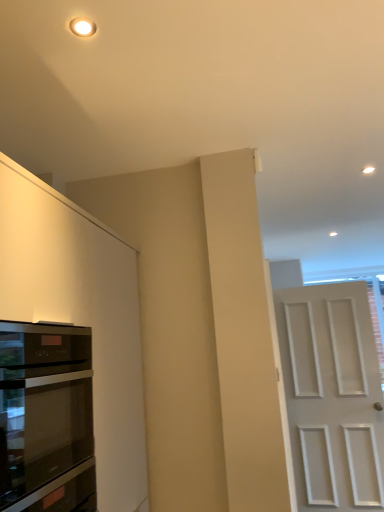
Question: Considering the relative sizes of matte white cabinet at left and black glass oven at left in the image provided, is matte white cabinet at left bigger than black glass oven at left?

Choices:
 (A) yes
 (B) no

Answer: (A)

Question: Is matte white cabinet at left thinner than black glass oven at left?

Choices:
 (A) no
 (B) yes

Answer: (A)

Question: From the image's perspective, is matte white cabinet at left below black glass oven at left?

Choices:
 (A) no
 (B) yes

Answer: (B)

Question: Would you say matte white cabinet at left is outside black glass oven at left?

Choices:
 (A) yes
 (B) no

Answer: (A)

Question: Does matte white cabinet at left have a greater width compared to black glass oven at left?

Choices:
 (A) no
 (B) yes

Answer: (B)

Question: In the image, is matte white cabinet at left positioned in front of or behind black glass oven at left?

Choices:
 (A) behind
 (B) front

Answer: (B)

Question: From a real-world perspective, is matte white cabinet at left physically located above or below black glass oven at left?

Choices:
 (A) above
 (B) below

Answer: (A)

Question: Looking at the image, does matte white cabinet at left seem bigger or smaller compared to black glass oven at left?

Choices:
 (A) big
 (B) small

Answer: (A)

Question: Looking at their shapes, would you say matte white cabinet at left is wider or thinner than black glass oven at left?

Choices:
 (A) thin
 (B) wide

Answer: (B)

Question: Is white matte door at right taller or shorter than black glass oven at left?

Choices:
 (A) short
 (B) tall

Answer: (B)

Question: Is white matte door at right bigger or smaller than black glass oven at left?

Choices:
 (A) big
 (B) small

Answer: (A)

Question: Is white matte door at right spatially inside black glass oven at left, or outside of it?

Choices:
 (A) inside
 (B) outside

Answer: (B)

Question: In the image, is white matte door at right positioned in front of or behind black glass oven at left?

Choices:
 (A) behind
 (B) front

Answer: (A)

Question: Relative to matte white cabinet at left, is black glass oven at left in front or behind?

Choices:
 (A) front
 (B) behind

Answer: (B)

Question: From a real-world perspective, is black glass oven at left above or below matte white cabinet at left?

Choices:
 (A) below
 (B) above

Answer: (A)